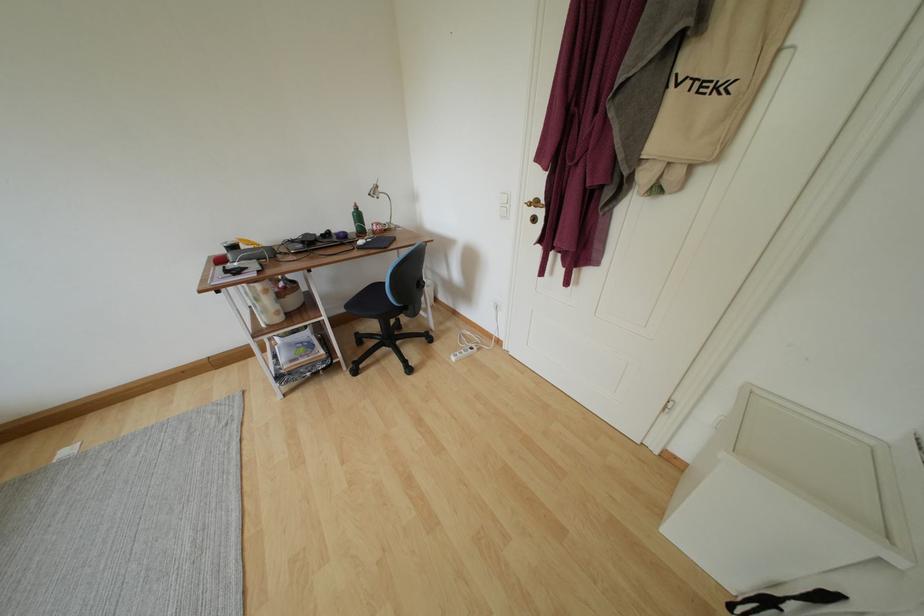
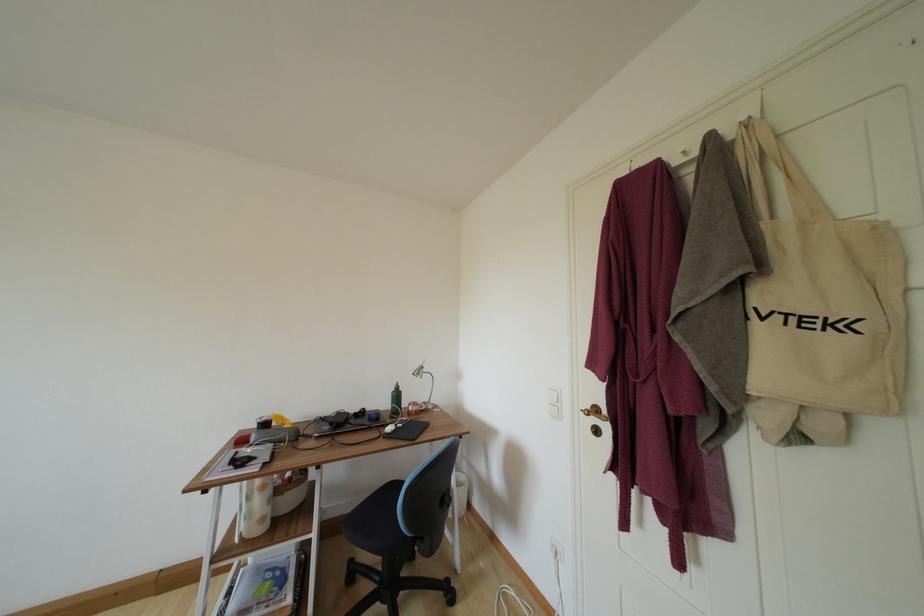
Locate, in the second image, the point that corresponds to point (385, 193) in the first image.

(430, 374)